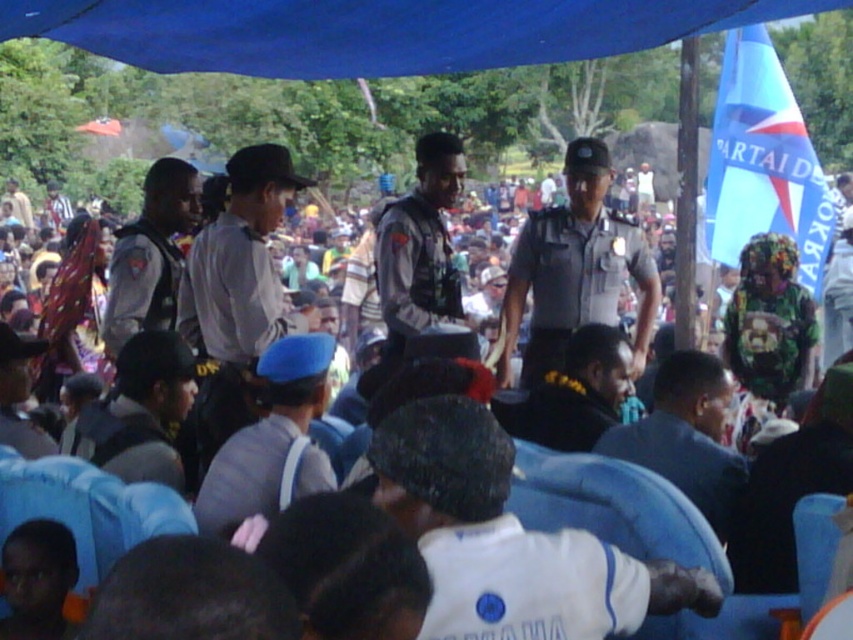
Is white shirt at center positioned in front of black fabric headband at center?

No, white shirt at center is behind black fabric headband at center.

Is white shirt at center below black fabric headband at center?

No, white shirt at center is not below black fabric headband at center.

This screenshot has height=640, width=853. Find the location of `white shirt at center`. white shirt at center is located at coordinates (236, 291).

Looking at this image, is blue fabric hat at center in front of light brown uniform at center?

Yes.

Consider the image. Can you confirm if blue fabric hat at center is bigger than light brown uniform at center?

Yes.

At what (x,y) coordinates should I click in order to perform the action: click on blue fabric hat at center. Please return your answer as a coordinate pair (x, y). Looking at the image, I should click on (271, 440).

Image resolution: width=853 pixels, height=640 pixels. What are the coordinates of `blue fabric hat at center` in the screenshot? It's located at (271, 440).

Does white shirt at center have a larger size compared to gray uniform at center?

Yes, white shirt at center is bigger than gray uniform at center.

Is white shirt at center behind gray uniform at center?

That is False.

In order to click on white shirt at center in this screenshot , I will do `click(236, 291)`.